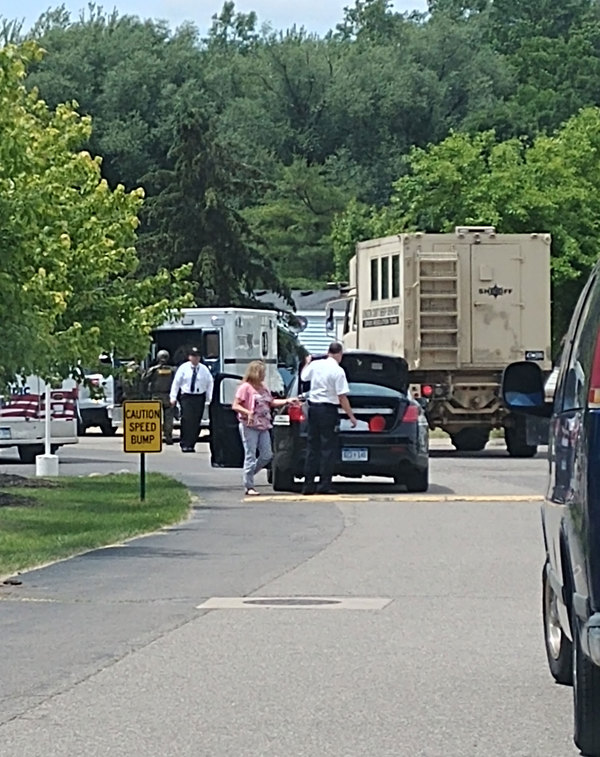
What are the coordinates of `ladder` in the screenshot? It's located at (439, 313).